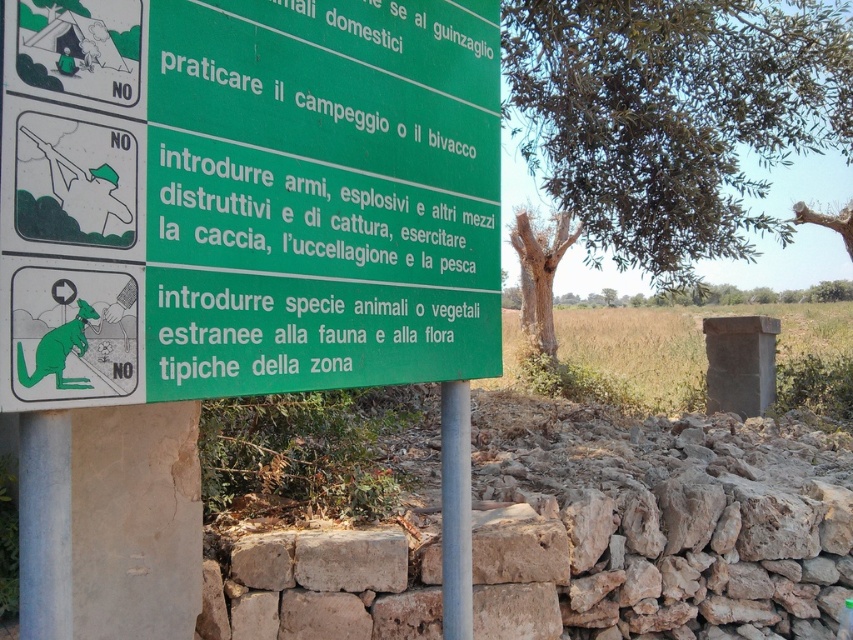
Question: Can you confirm if green leafy tree at upper center is positioned to the left of brown textured tree at upper right?

Choices:
 (A) no
 (B) yes

Answer: (A)

Question: Which is nearer to the brown textured tree at upper right?

Choices:
 (A) gray metallic pole at center
 (B) green leafy tree at upper center

Answer: (B)

Question: Is green leafy tree at upper center below gray metallic pole at center?

Choices:
 (A) no
 (B) yes

Answer: (A)

Question: Based on their relative distances, which object is farther from the green leafy tree at upper center?

Choices:
 (A) brown textured tree at upper right
 (B) gray metallic pole at center

Answer: (B)

Question: Where is gray metallic pole at center located in relation to brown textured tree at upper right in the image?

Choices:
 (A) left
 (B) right

Answer: (A)

Question: Which point is farther to the camera?

Choices:
 (A) gray metallic pole at center
 (B) brown textured tree at upper right
 (C) green leafy tree at upper center

Answer: (B)